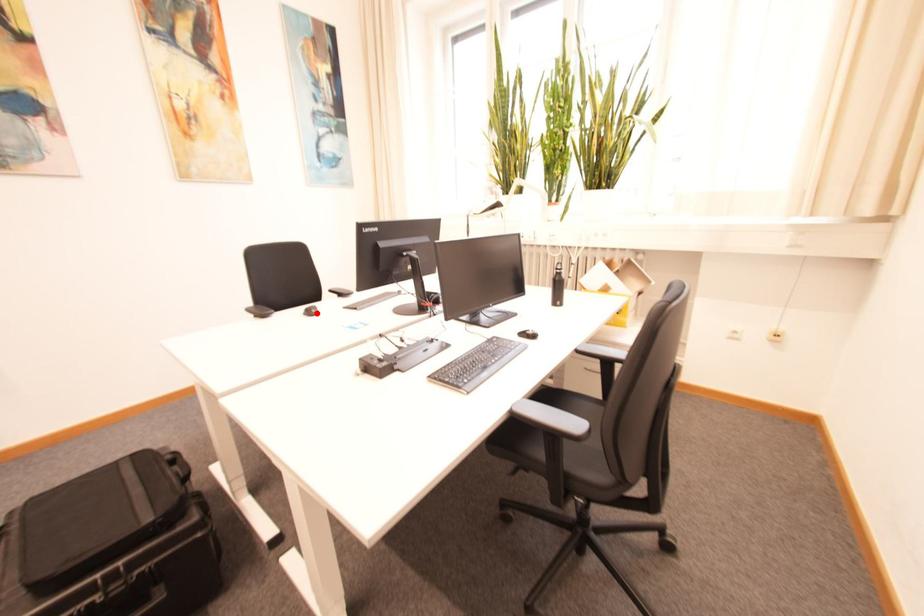
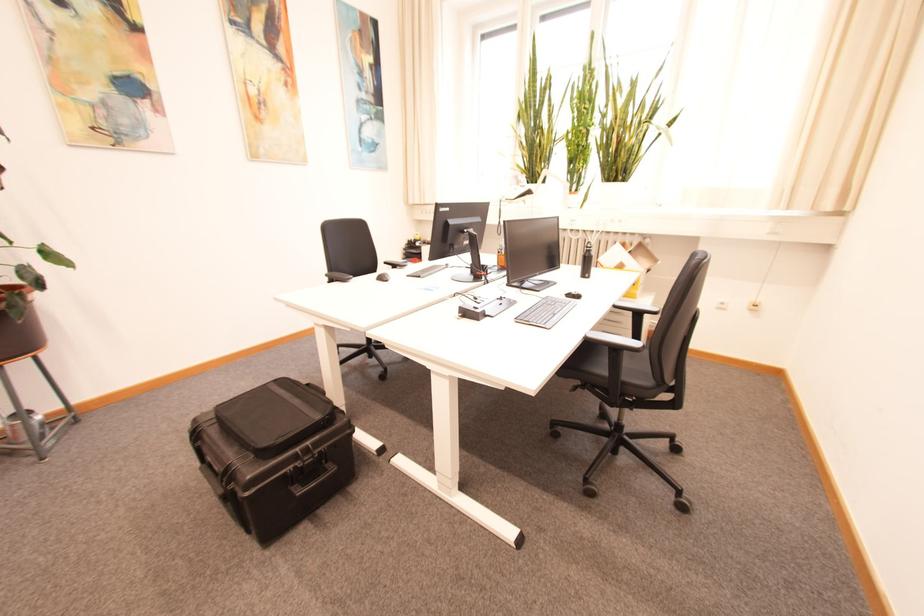
Locate, in the second image, the point that corresponds to the highlighted location in the first image.

(388, 280)